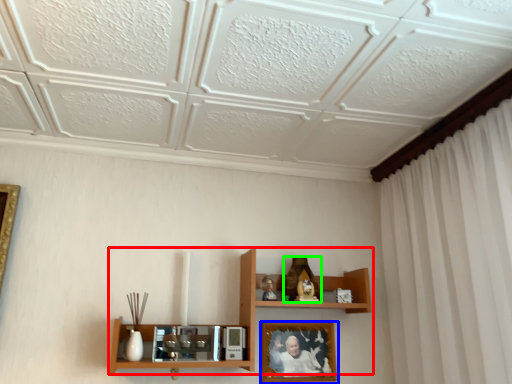
Question: Based on their relative distances, which object is nearer to shelf (highlighted by a red box)? Choose from picture frame (highlighted by a blue box) and toy (highlighted by a green box).

Choices:
 (A) picture frame
 (B) toy

Answer: (A)